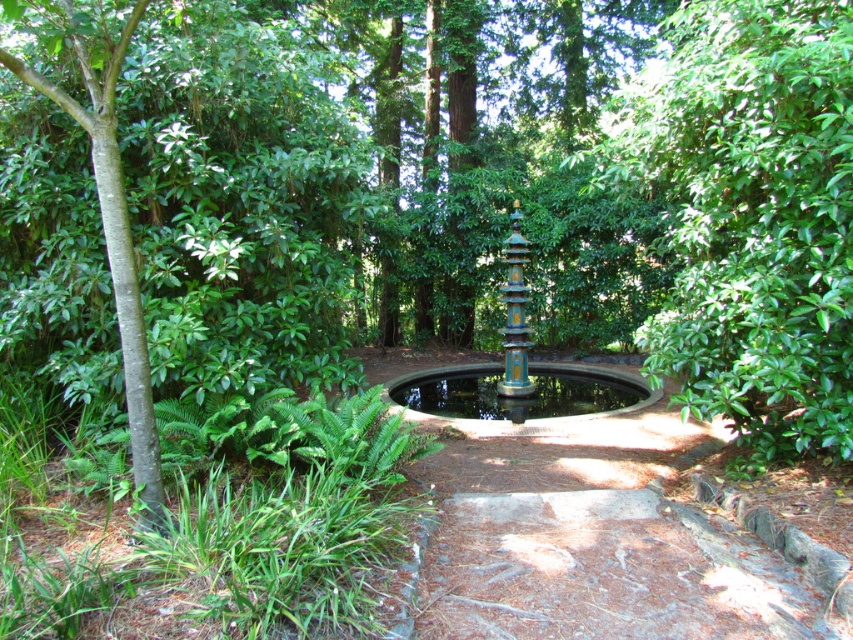
You are a gardener who needs to place a new 5 meter long wooden bench between the green smooth bark tree at left and the blue painted metal fountain at center. Is there enough space to place the bench between them?

The distance between the green smooth bark tree at left and the blue painted metal fountain at center is 5.01 meters, so yes, there is enough space to place the 5 meter long wooden bench between them.

In the scene shown: You are standing in the garden and want to take a photo of both the green smooth bark tree at left and the blue painted metal fountain at center. Which object should you focus on first to ensure both are in the frame?

You should focus on the green smooth bark tree at left first because it is closer to you than the blue painted metal fountain at center, so adjusting the camera to include both would require starting with the closer object.

You are standing in the garden and want to reach both the point at coordinates point (724, 392) and the point at coordinates point (519, 324). Which point should you reach first to minimize the distance walked?

You should reach point (724, 392) first since it is closer to you than point (519, 324).